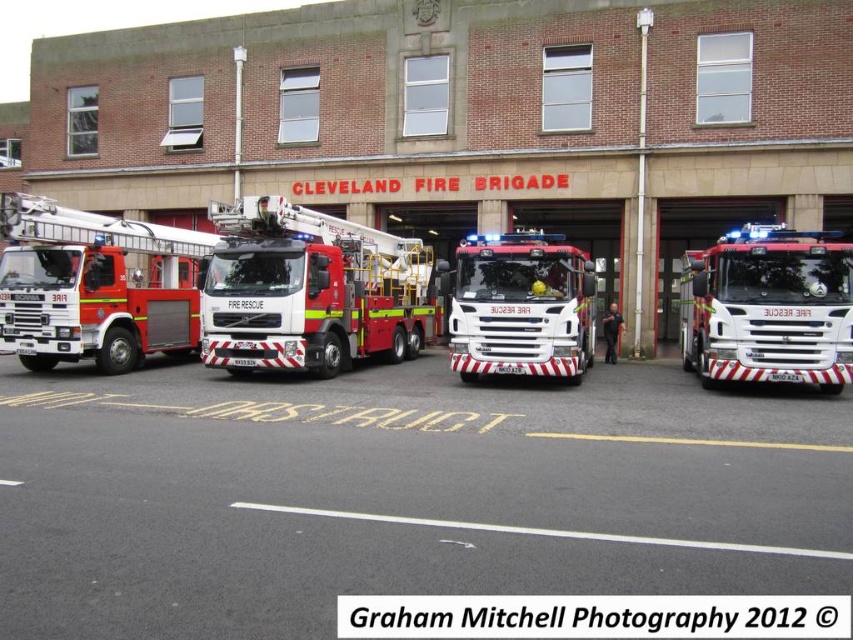
Question: Is red matte fire truck at center wider than red glossy fire truck at right?

Choices:
 (A) yes
 (B) no

Answer: (A)

Question: Does red matte fire truck at center come behind red matte fire truck at left?

Choices:
 (A) yes
 (B) no

Answer: (B)

Question: Can you confirm if red glossy fire truck at right is smaller than red glossy fire truck at center?

Choices:
 (A) yes
 (B) no

Answer: (B)

Question: Which point appears farthest from the camera in this image?

Choices:
 (A) (312, 371)
 (B) (584, 259)
 (C) (173, 268)

Answer: (C)

Question: Which point is closer to the camera taking this photo?

Choices:
 (A) (50, 289)
 (B) (810, 248)

Answer: (B)

Question: Among these objects, which one is farthest from the camera?

Choices:
 (A) red matte fire truck at center
 (B) red glossy fire truck at center

Answer: (A)